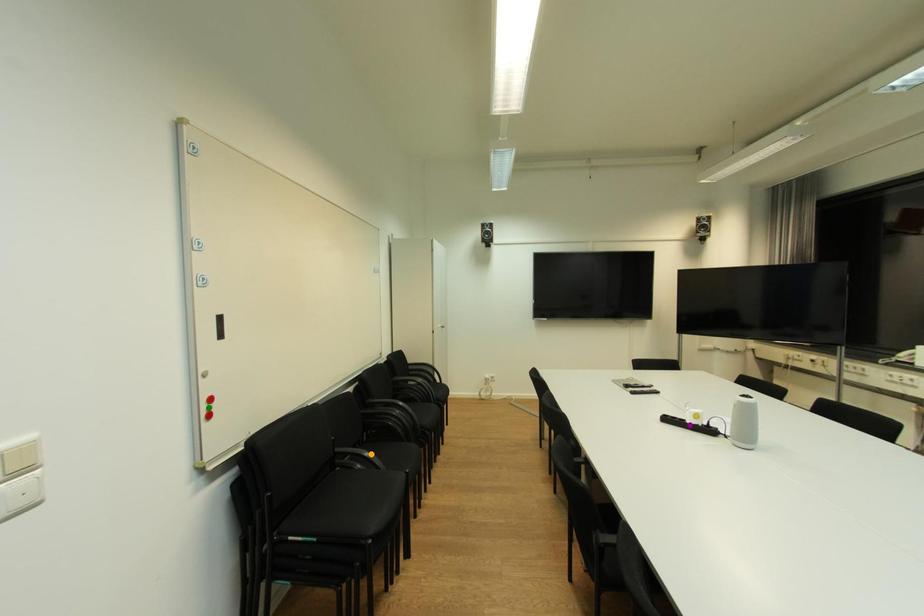
Order these from nearest to farthest:
purple point
green point
orange point

orange point → purple point → green point